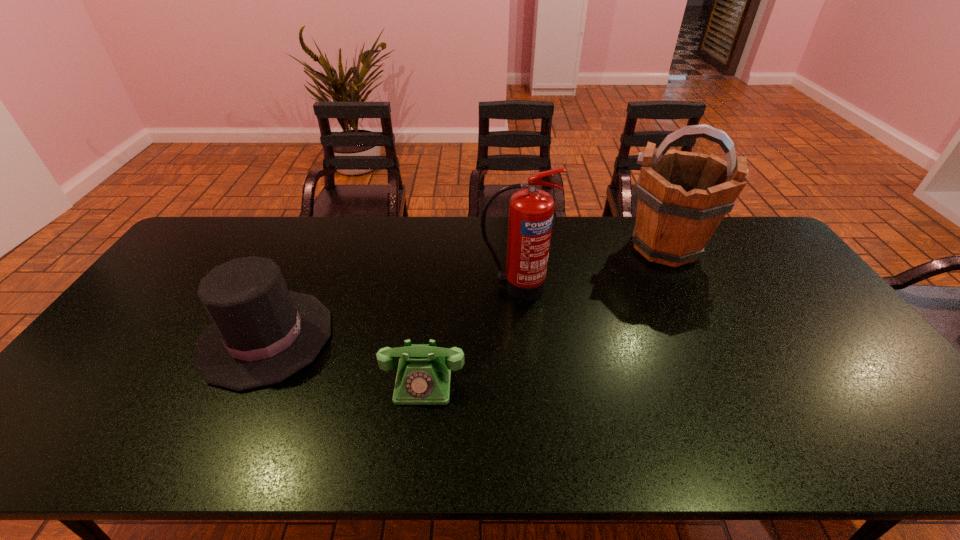
Image resolution: width=960 pixels, height=540 pixels. Find the location of `free region at the far edge of the desktop`. free region at the far edge of the desktop is located at coordinates (426, 219).

Identify the location of free space at the right edge of the desktop. (767, 285).

You are a GUI agent. You are given a task and a screenshot of the screen. Output one action in this format:
    pyautogui.click(x=<x>, y=<y>)
    Task: Click on the vacant space at the far left corner
    Image resolution: width=960 pixels, height=540 pixels.
    Given the screenshot: What is the action you would take?
    pyautogui.click(x=216, y=247)

You are a GUI agent. You are given a task and a screenshot of the screen. Output one action in this format:
    pyautogui.click(x=<x>, y=<y>)
    Task: Click on the free spot at the near left corner of the desktop
    This screenshot has width=960, height=540.
    Given the screenshot: What is the action you would take?
    pyautogui.click(x=51, y=444)

Where is `vacant region at the far right corner of the desktop`? vacant region at the far right corner of the desktop is located at coordinates (721, 238).

Where is `free point between the third object from left to right and the bucket`? The width and height of the screenshot is (960, 540). free point between the third object from left to right and the bucket is located at coordinates (590, 267).

Image resolution: width=960 pixels, height=540 pixels. In order to click on unoccupied area between the rightmost object and the dress hat in this screenshot , I will do `click(466, 292)`.

At what (x,y) coordinates should I click in order to perform the action: click on free spot between the shortest object and the bucket. Please return your answer as a coordinate pair (x, y). The height and width of the screenshot is (540, 960). Looking at the image, I should click on (544, 314).

Find the location of a particular element. The width and height of the screenshot is (960, 540). vacant space that is in between the second object from right to left and the dress hat is located at coordinates (391, 312).

Identify the location of vacant area between the second object from right to left and the third tallest object. This screenshot has width=960, height=540. (391, 312).